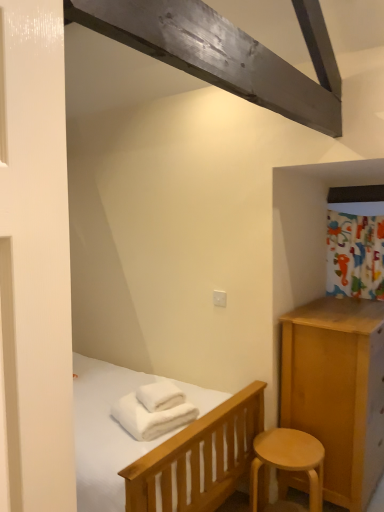
Question: Can you confirm if white soft bath towel at lower center, the 2th bath towel when ordered from top to bottom, is bigger than white soft towel at center, which appears as the second bath towel when ordered from the bottom?

Choices:
 (A) no
 (B) yes

Answer: (B)

Question: From a real-world perspective, is white soft bath towel at lower center, acting as the first bath towel starting from the bottom, under white soft towel at center, which appears as the second bath towel when ordered from the bottom?

Choices:
 (A) no
 (B) yes

Answer: (B)

Question: Is white soft bath towel at lower center, acting as the first bath towel starting from the bottom, positioned before white soft towel at center, which appears as the second bath towel when ordered from the bottom?

Choices:
 (A) no
 (B) yes

Answer: (B)

Question: Can you confirm if white soft bath towel at lower center, acting as the first bath towel starting from the bottom, is taller than white soft towel at center, which appears as the second bath towel when ordered from the bottom?

Choices:
 (A) no
 (B) yes

Answer: (B)

Question: Does white soft bath towel at lower center, acting as the first bath towel starting from the bottom, turn towards white soft towel at center, arranged as the first bath towel when viewed from the top?

Choices:
 (A) yes
 (B) no

Answer: (B)

Question: Visually, is white soft bath towel at lower center, acting as the first bath towel starting from the bottom, positioned to the left or to the right of light wood stool at lower right?

Choices:
 (A) left
 (B) right

Answer: (A)

Question: Choose the correct answer: Is white soft bath towel at lower center, acting as the first bath towel starting from the bottom, inside light wood stool at lower right or outside it?

Choices:
 (A) outside
 (B) inside

Answer: (A)

Question: From their relative heights in the image, would you say white soft bath towel at lower center, acting as the first bath towel starting from the bottom, is taller or shorter than light wood stool at lower right?

Choices:
 (A) tall
 (B) short

Answer: (B)

Question: Is point (135, 428) positioned closer to the camera than point (256, 444)?

Choices:
 (A) closer
 (B) farther

Answer: (A)

Question: From the image's perspective, is white soft bath towel at lower center, acting as the first bath towel starting from the bottom, located above or below white soft towel at center, which appears as the second bath towel when ordered from the bottom?

Choices:
 (A) below
 (B) above

Answer: (A)

Question: Considering the positions of white soft bath towel at lower center, acting as the first bath towel starting from the bottom, and white soft towel at center, arranged as the first bath towel when viewed from the top, in the image, is white soft bath towel at lower center, acting as the first bath towel starting from the bottom, bigger or smaller than white soft towel at center, arranged as the first bath towel when viewed from the top,?

Choices:
 (A) small
 (B) big

Answer: (B)

Question: Do you think white soft bath towel at lower center, acting as the first bath towel starting from the bottom, is within white soft towel at center, which appears as the second bath towel when ordered from the bottom, or outside of it?

Choices:
 (A) inside
 (B) outside

Answer: (B)

Question: Is point (162, 415) closer or farther from the camera than point (180, 399)?

Choices:
 (A) farther
 (B) closer

Answer: (B)

Question: Is white soft towel at center, arranged as the first bath towel when viewed from the top, to the left or to the right of white soft bath towel at lower center, the 2th bath towel when ordered from top to bottom, in the image?

Choices:
 (A) left
 (B) right

Answer: (B)

Question: Relative to white soft bath towel at lower center, acting as the first bath towel starting from the bottom, is white soft towel at center, arranged as the first bath towel when viewed from the top, in front or behind?

Choices:
 (A) front
 (B) behind

Answer: (B)